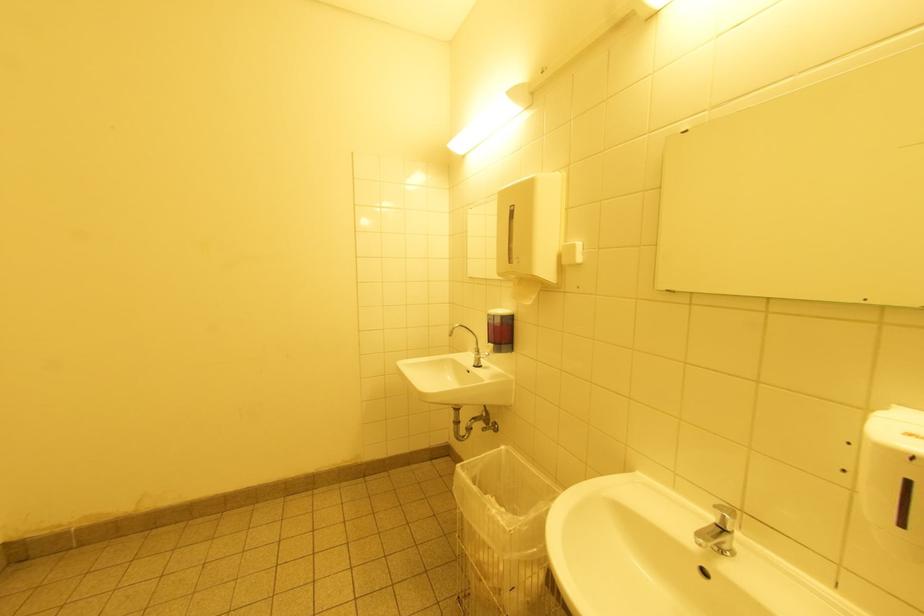
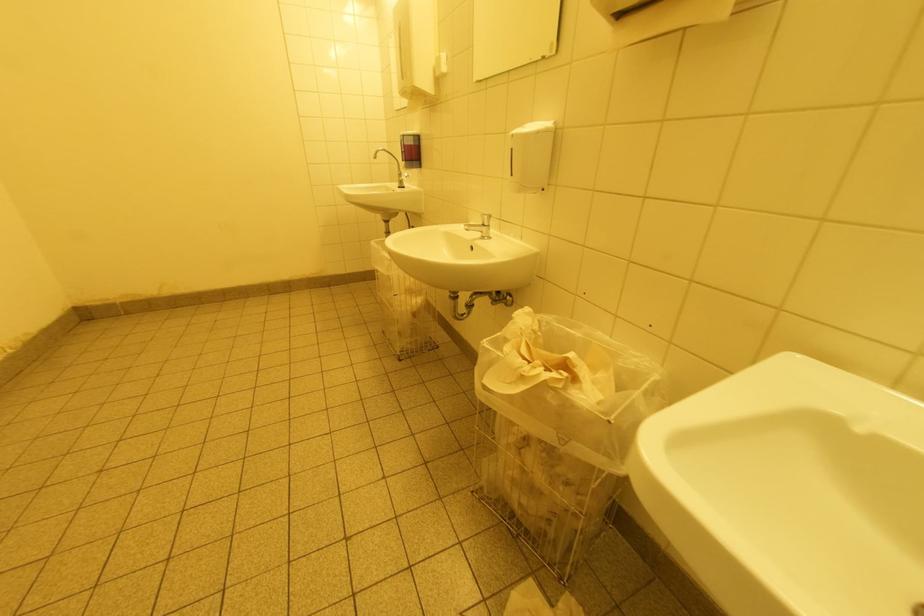
In a continuous first-person perspective shot, in which direction is the camera moving?

The cameraman moved toward right, backward.